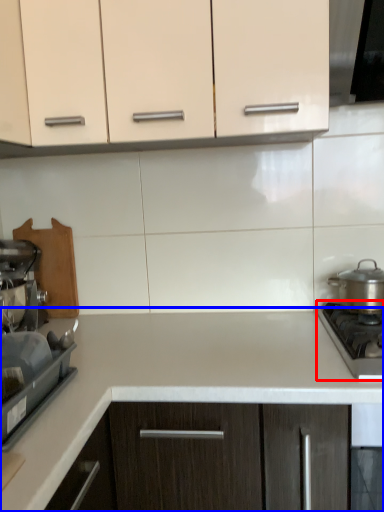
Question: Among these objects, which one is nearest to the camera, gas stove (highlighted by a red box) or countertop (highlighted by a blue box)?

Choices:
 (A) gas stove
 (B) countertop

Answer: (B)